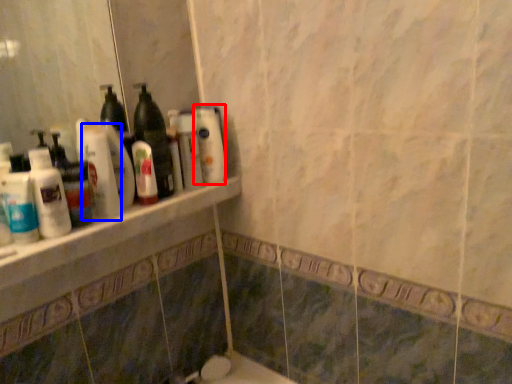
Question: Which point is closer to the camera, cleaning product (highlighted by a red box) or cleaning product (highlighted by a blue box)?

Choices:
 (A) cleaning product
 (B) cleaning product

Answer: (B)